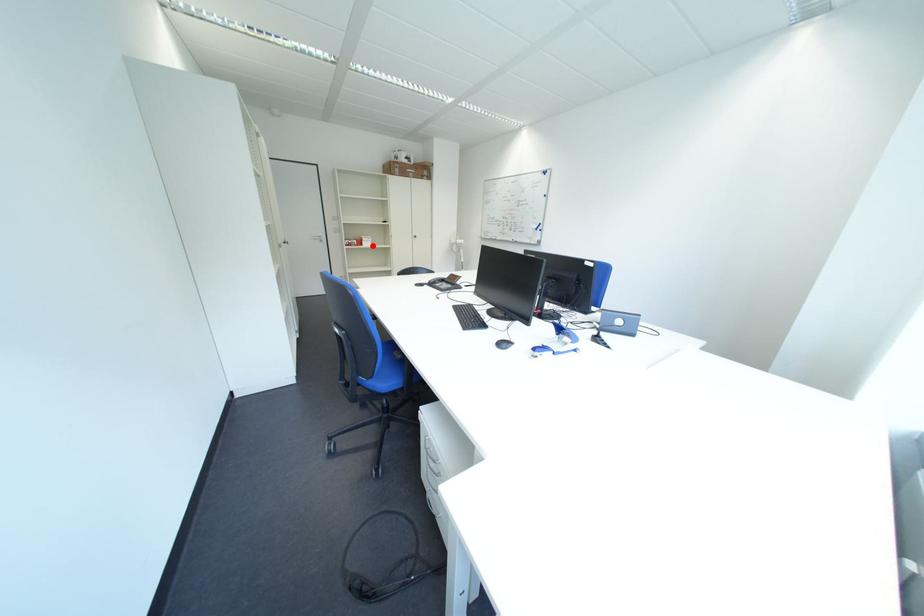
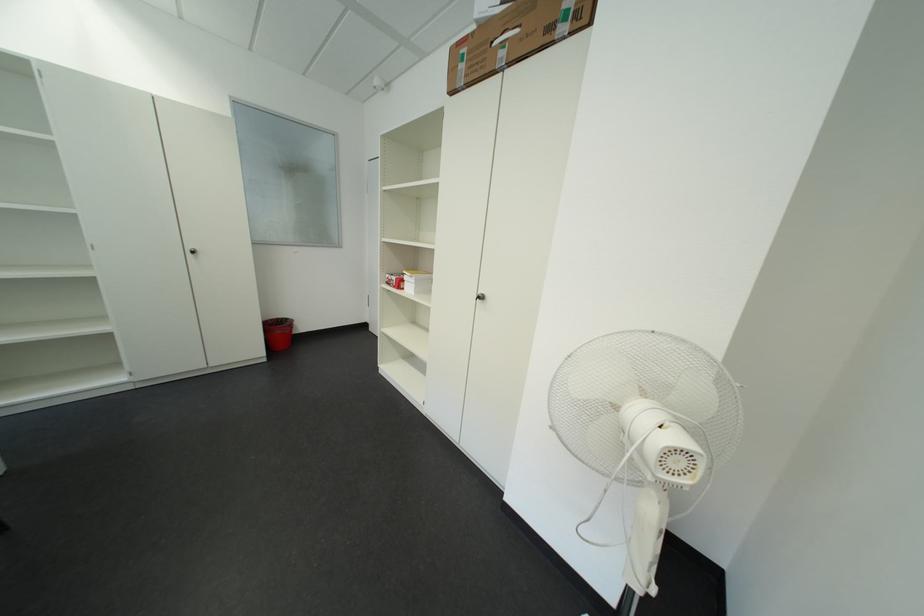
Question: I am providing you with two images of the same scene from different viewpoints. Image1 has a red point marked. In image2, the corresponding 3D location appears at what relative position? Reply with the corresponding letter.

Choices:
 (A) Closer
 (B) Farther

Answer: (B)